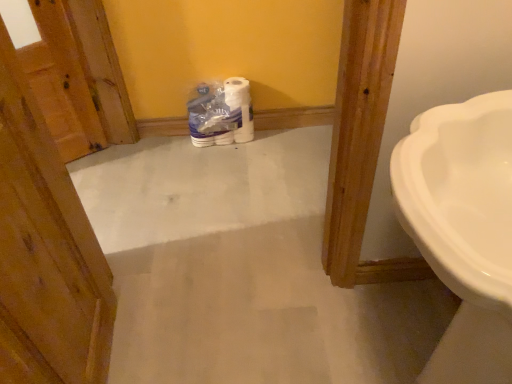
Question: Considering the relative sizes of white glossy sink at right and white glossy toilet paper at center in the image provided, is white glossy sink at right thinner than white glossy toilet paper at center?

Choices:
 (A) yes
 (B) no

Answer: (B)

Question: Is white glossy sink at right not within white glossy toilet paper at center?

Choices:
 (A) yes
 (B) no

Answer: (A)

Question: Is white glossy sink at right looking in the opposite direction of white glossy toilet paper at center?

Choices:
 (A) no
 (B) yes

Answer: (A)

Question: Does white glossy sink at right have a smaller size compared to white glossy toilet paper at center?

Choices:
 (A) no
 (B) yes

Answer: (A)

Question: Does white glossy sink at right have a greater width compared to white glossy toilet paper at center?

Choices:
 (A) no
 (B) yes

Answer: (B)

Question: Is white glossy sink at right in front of white glossy toilet paper at center?

Choices:
 (A) yes
 (B) no

Answer: (A)

Question: Would you say white glossy sink at right is outside wooden door at left?

Choices:
 (A) no
 (B) yes

Answer: (B)

Question: Could you tell me if white glossy sink at right is facing wooden door at left?

Choices:
 (A) no
 (B) yes

Answer: (B)

Question: Considering the relative sizes of white glossy sink at right and wooden door at left in the image provided, is white glossy sink at right thinner than wooden door at left?

Choices:
 (A) yes
 (B) no

Answer: (B)

Question: Considering the relative sizes of white glossy sink at right and wooden door at left in the image provided, is white glossy sink at right shorter than wooden door at left?

Choices:
 (A) no
 (B) yes

Answer: (B)

Question: Considering the relative positions of white glossy sink at right and wooden door at left in the image provided, is white glossy sink at right to the right of wooden door at left from the viewer's perspective?

Choices:
 (A) no
 (B) yes

Answer: (B)

Question: From a real-world perspective, is white glossy sink at right below wooden door at left?

Choices:
 (A) yes
 (B) no

Answer: (A)

Question: Is white glossy sink at right at the back of wooden door at left?

Choices:
 (A) yes
 (B) no

Answer: (B)